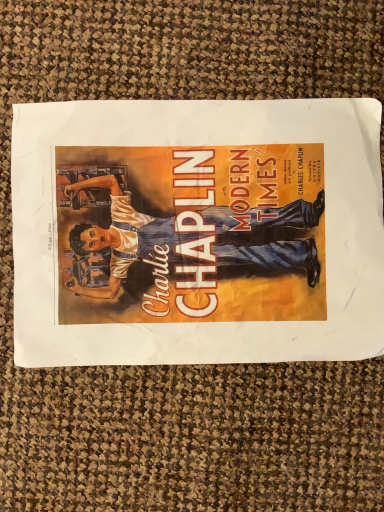
Locate an element on the screen. The image size is (384, 512). free spot above matte paper poster at center (from a real-world perspective) is located at coordinates (200, 229).